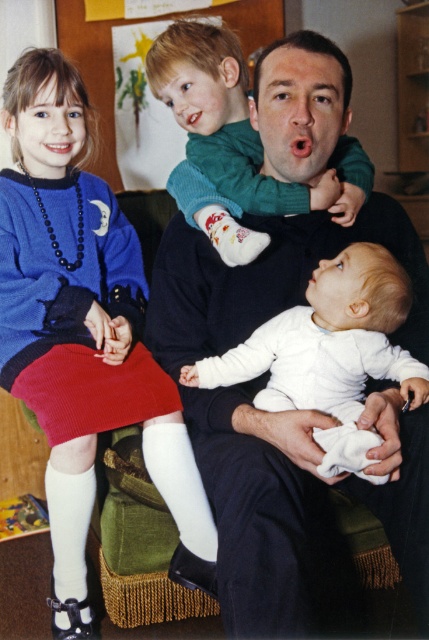
Who is lower down, dark blue sweater at upper center or knitted blue sweater at upper left?

dark blue sweater at upper center

Describe the element at coordinates (269, 516) in the screenshot. The height and width of the screenshot is (640, 429). I see `dark blue sweater at upper center` at that location.

Is point (162, 240) positioned in front of point (54, 436)?

No, (162, 240) is behind (54, 436).

At what (x,y) coordinates should I click in order to perform the action: click on dark blue sweater at upper center. Please return your answer as a coordinate pair (x, y). The width and height of the screenshot is (429, 640). Looking at the image, I should click on (269, 516).

What do you see at coordinates (269, 516) in the screenshot? I see `dark blue sweater at upper center` at bounding box center [269, 516].

Is dark blue sweater at upper center bigger than green sweater at upper center?

Yes, dark blue sweater at upper center is bigger than green sweater at upper center.

Measure the distance between point (393, 472) and camera.

Point (393, 472) is 3.79 feet from camera.

The width and height of the screenshot is (429, 640). In order to click on dark blue sweater at upper center in this screenshot , I will do `click(269, 516)`.

Between knitted blue sweater at upper left and green sweater at upper center, which one appears on the left side from the viewer's perspective?

Positioned to the left is knitted blue sweater at upper left.

Does knitted blue sweater at upper left have a greater width compared to green sweater at upper center?

Correct, the width of knitted blue sweater at upper left exceeds that of green sweater at upper center.

Measure the distance between knitted blue sweater at upper left and camera.

knitted blue sweater at upper left is 4.27 feet away from camera.

At what (x,y) coordinates should I click in order to perform the action: click on knitted blue sweater at upper left. Please return your answer as a coordinate pair (x, y). This screenshot has width=429, height=640. Looking at the image, I should click on (81, 324).